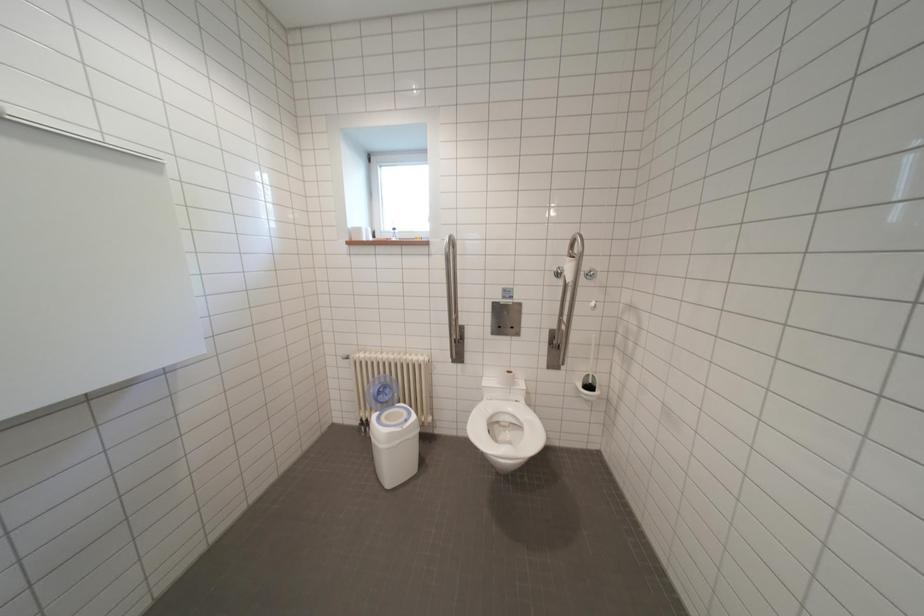
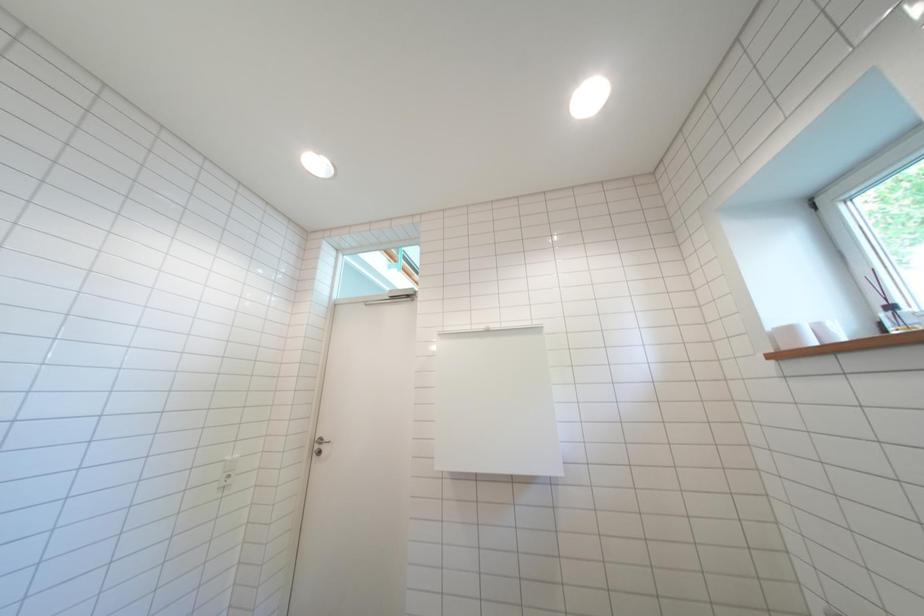
First-person continuous shooting, in which direction is the camera rotating?

The rotation direction of the camera is left-up.